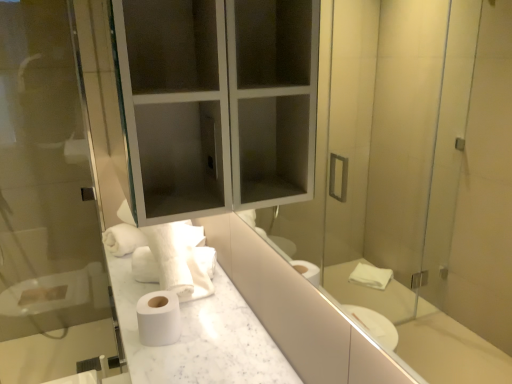
Where is `unoccupied region to the right of white matte toilet paper at center`? This screenshot has height=384, width=512. unoccupied region to the right of white matte toilet paper at center is located at coordinates (212, 333).